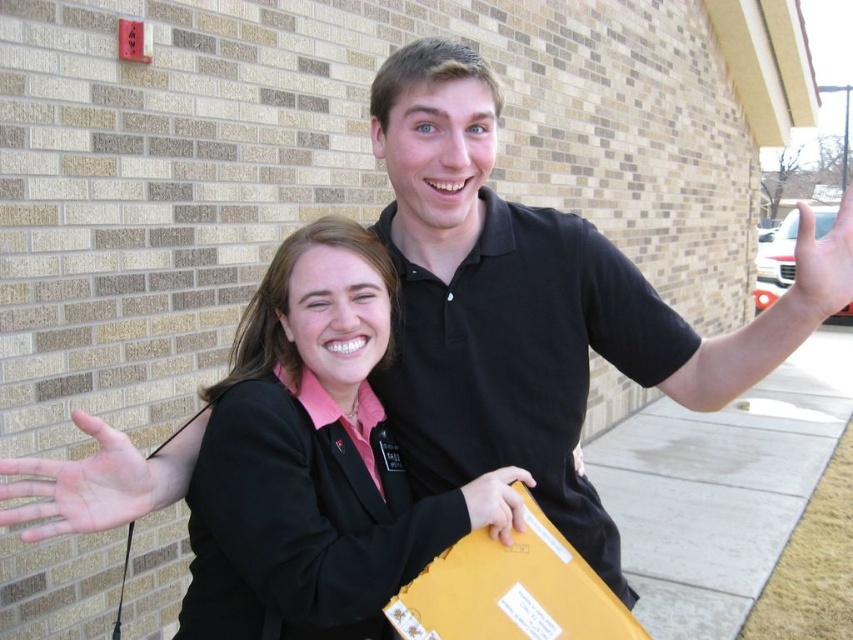
You are a photographer trying to capture a clear photo of the matte yellow folder at center. However, the pink matte hand at lower left is blocking your view. Can you adjust your position to take the photo without moving the objects?

The pink matte hand at lower left is in front of the matte yellow folder at center, so moving your camera position slightly to the right or left might allow you to see around the hand and capture the folder without moving the objects.

You are a photographer trying to capture a photo of the two people in the scene. You want to ensure that the black matte jacket at center and the pink matte hand at lower left are both visible in the frame. Based on their positions, which object should be placed closer to the left side of the photo?

The pink matte hand at lower left should be placed closer to the left side of the photo since the black matte jacket at center is to the right of it.

You are standing at the point labeled point (550, 576) and want to take a photo of the two people in front of the brick wall. If your camera can focus on objects within 1.5 meters, will it be able to capture them clearly?

The distance between point (550, 576) and the camera is 1.48 meters, which is within the camera focus range of 1.5 meters. Therefore, the camera can capture them clearly.